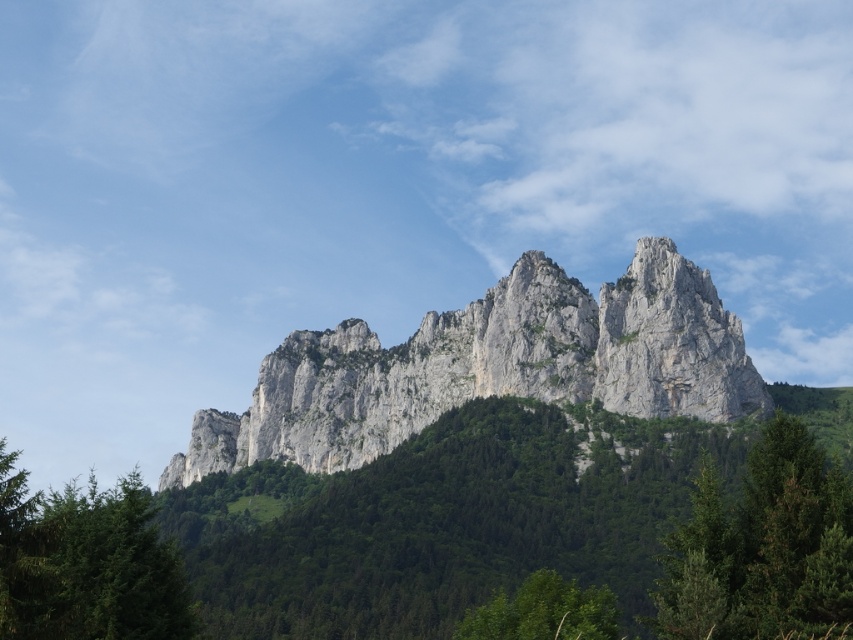
You are a hiker planning to reach the rugged stone mountain at center. You see a point marked at coordinates point (491, 365). Is this point located on the rugged stone mountain at center?

Yes, the point (491, 365) is located on the rugged stone mountain at center according to the description.

You are a hiker standing at the base of the mountain and looking towards the green leafy tree at center and the green leafy tree at lower center. Which tree appears larger in the image?

The green leafy tree at center appears larger than the green leafy tree at lower center in the image.

Looking at this image, you are an environmental scientist observing the mountain and tree. Which object is closer to you, the rugged stone mountain at center or the green matte tree at lower left?

The rugged stone mountain at center is closer to you because the green matte tree at lower left is behind it.